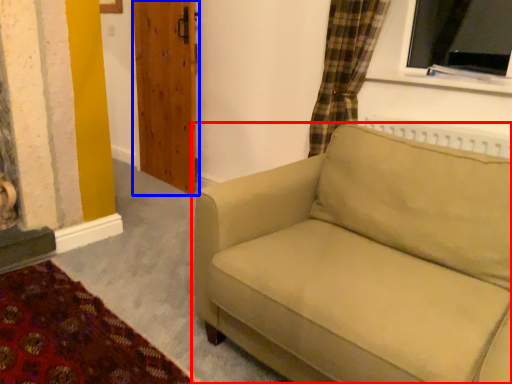
Question: Which object is further to the camera taking this photo, studio couch (highlighted by a red box) or door (highlighted by a blue box)?

Choices:
 (A) studio couch
 (B) door

Answer: (B)